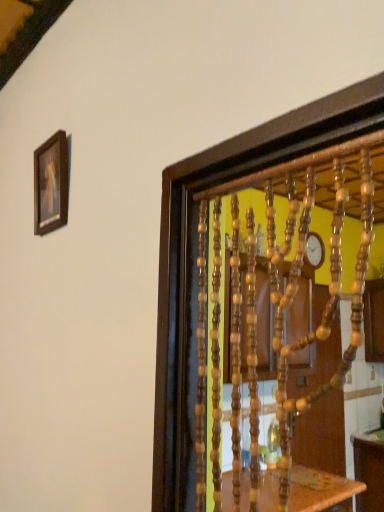
The width and height of the screenshot is (384, 512). What do you see at coordinates (51, 184) in the screenshot?
I see `wooden framed painting at upper left` at bounding box center [51, 184].

At what (x,y) coordinates should I click in order to perform the action: click on wooden framed painting at upper left. Please return your answer as a coordinate pair (x, y). Looking at the image, I should click on (51, 184).

Image resolution: width=384 pixels, height=512 pixels. I want to click on wooden framed painting at upper left, so click(x=51, y=184).